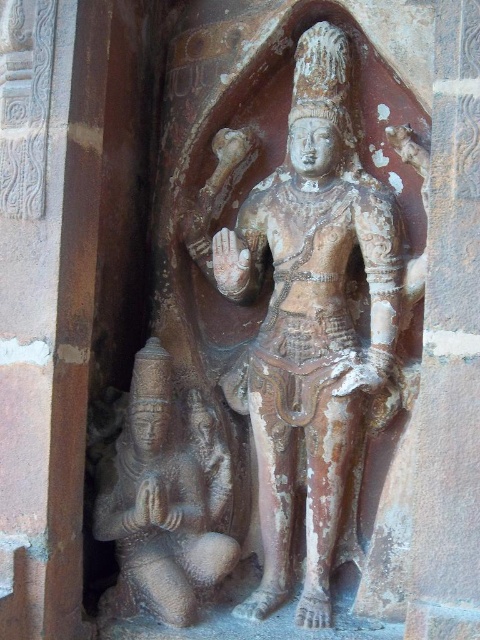
Question: Can you confirm if brown stone statue at center is thinner than rusty stone statue at lower left?

Choices:
 (A) no
 (B) yes

Answer: (A)

Question: Which point appears farthest from the camera in this image?

Choices:
 (A) (302, 355)
 (B) (107, 464)

Answer: (B)

Question: Does brown stone statue at center have a greater width compared to rusty stone statue at lower left?

Choices:
 (A) yes
 (B) no

Answer: (A)

Question: Is brown stone statue at center above rusty stone statue at lower left?

Choices:
 (A) no
 (B) yes

Answer: (B)

Question: Which object appears closest to the camera in this image?

Choices:
 (A) rusty stone statue at lower left
 (B) brown stone statue at center

Answer: (A)